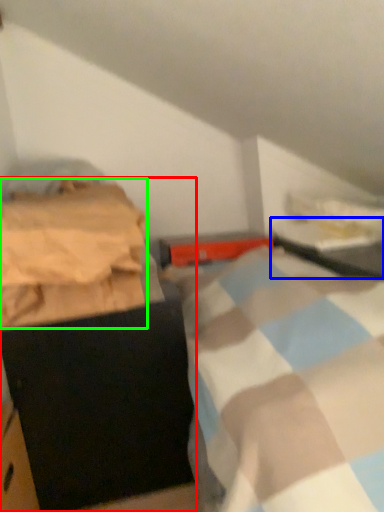
Question: Based on their relative distances, which object is farther from furniture (highlighted by a red box)? Choose from table (highlighted by a blue box) and blanket (highlighted by a green box).

Choices:
 (A) table
 (B) blanket

Answer: (A)